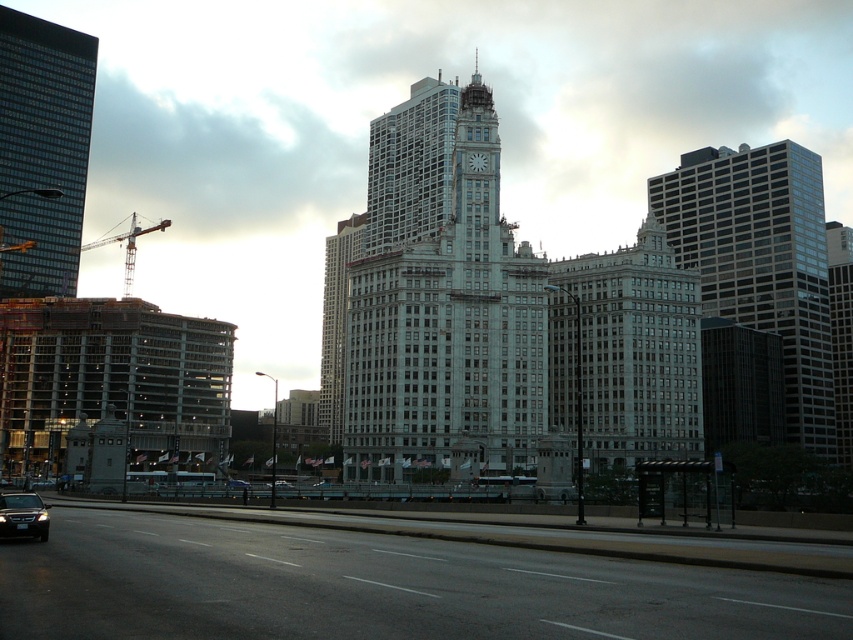
Looking at this image, you are a delivery driver navigating through the city. You see the black asphalt highway at lower center represented by point (x=375, y=588). Can you confirm if this point is on the highway?

The black asphalt highway at lower center is represented by point (x=375, y=588), so yes, this point is on the highway.

You are a city planner reviewing this urban layout. The black asphalt highway at lower center and the gray glass building at center are both part of the city infrastructure. Which of these two has a larger footprint in terms of physical space occupied?

The gray glass building at center has a larger footprint than the black asphalt highway at lower center because the highway is described as smaller.

You are a delivery driver approaching the black asphalt highway at lower center and the gray glass building at center. Which one is closer to the ground level?

The black asphalt highway at lower center is positioned under the gray glass building at center, so it is closer to the ground level.